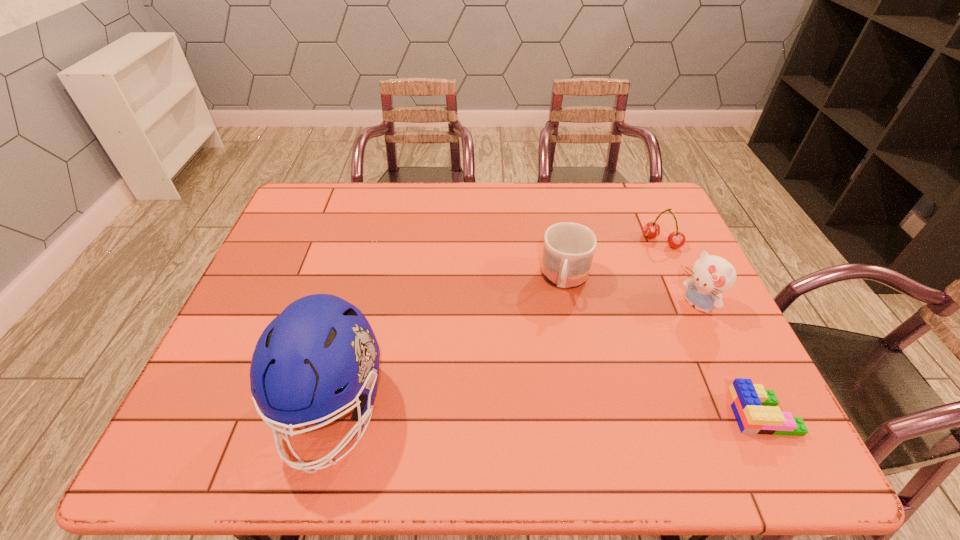
The image size is (960, 540). In order to click on blank space that satisfies the following two spatial constraints: 1. on the front side of the kitten; 2. on the left side of the Lego in this screenshot , I will do `click(745, 414)`.

You are a GUI agent. You are given a task and a screenshot of the screen. Output one action in this format:
    pyautogui.click(x=<x>, y=<y>)
    Task: Click on the free location that satisfies the following two spatial constraints: 1. on the front side of the shortest object; 2. on the right side of the farthest object
    The height and width of the screenshot is (540, 960).
    Given the screenshot: What is the action you would take?
    pyautogui.click(x=738, y=414)

Where is `vacant space that satisfies the following two spatial constraints: 1. on the front side of the Lego; 2. on the right side of the fourth shortest object`? vacant space that satisfies the following two spatial constraints: 1. on the front side of the Lego; 2. on the right side of the fourth shortest object is located at coordinates (745, 414).

At what (x,y) coordinates should I click in order to perform the action: click on free region that satisfies the following two spatial constraints: 1. on the front side of the kitten; 2. on the left side of the Lego. Please return your answer as a coordinate pair (x, y). The image size is (960, 540). Looking at the image, I should click on (745, 414).

What are the coordinates of `free space in the image that satisfies the following two spatial constraints: 1. on the front side of the Lego; 2. on the right side of the cherry` in the screenshot? It's located at (738, 414).